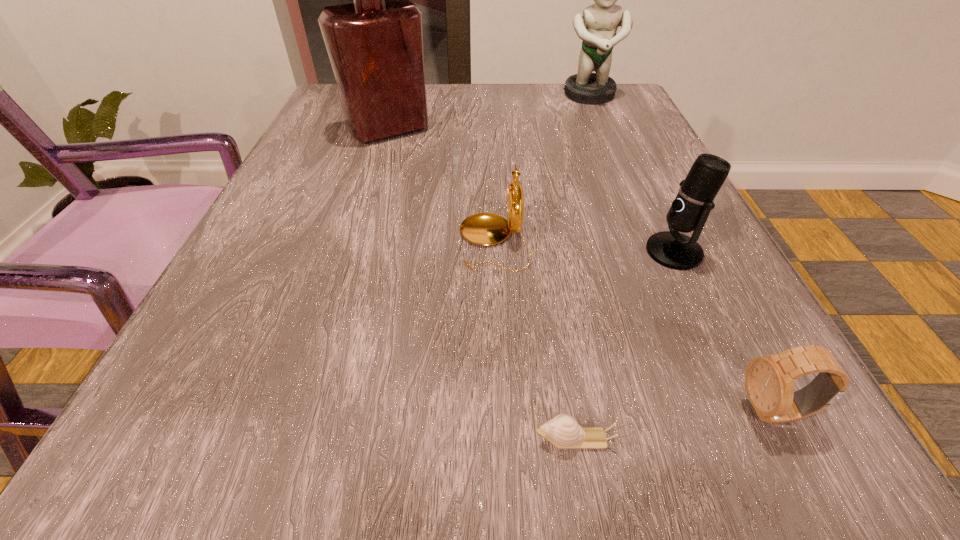
The width and height of the screenshot is (960, 540). What are the coordinates of `vacant space located 0.270m on the back of the third tallest object` in the screenshot? It's located at (627, 150).

The width and height of the screenshot is (960, 540). In order to click on vacant area located 0.200m on the face of the pocket watch in this screenshot , I will do `click(333, 242)`.

The height and width of the screenshot is (540, 960). I want to click on vacant space situated 0.240m on the face of the pocket watch, so click(308, 242).

This screenshot has height=540, width=960. What are the coordinates of `vacant region located on the face of the pocket watch` in the screenshot? It's located at (415, 242).

The width and height of the screenshot is (960, 540). What are the coordinates of `blank space located on the face of the watch` in the screenshot? It's located at (653, 412).

Where is `vacant space located on the face of the watch`? The height and width of the screenshot is (540, 960). vacant space located on the face of the watch is located at coordinates (500, 412).

Identify the location of free location located on the face of the watch. The width and height of the screenshot is (960, 540). (545, 412).

The image size is (960, 540). Find the location of `free region located 0.170m on the shell of the escargot`. free region located 0.170m on the shell of the escargot is located at coordinates (377, 438).

You are a GUI agent. You are given a task and a screenshot of the screen. Output one action in this format:
    pyautogui.click(x=<x>, y=<y>)
    Task: Click on the free space located on the shell of the escargot
    
    Given the screenshot: What is the action you would take?
    pyautogui.click(x=434, y=438)

The width and height of the screenshot is (960, 540). In order to click on vacant area located on the shell of the escargot in this screenshot , I will do `click(200, 438)`.